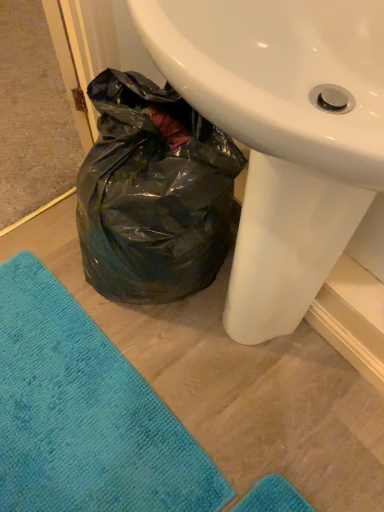
Question: From a real-world perspective, is teal soft towel at lower left physically below white glossy sink at center?

Choices:
 (A) no
 (B) yes

Answer: (B)

Question: Does teal soft towel at lower left have a smaller size compared to white glossy sink at center?

Choices:
 (A) yes
 (B) no

Answer: (A)

Question: From the image's perspective, does teal soft towel at lower left appear lower than white glossy sink at center?

Choices:
 (A) yes
 (B) no

Answer: (A)

Question: Is teal soft towel at lower left bigger than white glossy sink at center?

Choices:
 (A) yes
 (B) no

Answer: (B)

Question: Considering the relative sizes of teal soft towel at lower left and white glossy sink at center in the image provided, is teal soft towel at lower left shorter than white glossy sink at center?

Choices:
 (A) no
 (B) yes

Answer: (B)

Question: Can you see teal soft towel at lower left touching white glossy sink at center?

Choices:
 (A) no
 (B) yes

Answer: (A)

Question: Considering the relative sizes of white glossy sink at center and teal soft towel at lower left in the image provided, is white glossy sink at center smaller than teal soft towel at lower left?

Choices:
 (A) no
 (B) yes

Answer: (A)

Question: Does white glossy sink at center lie in front of teal soft towel at lower left?

Choices:
 (A) yes
 (B) no

Answer: (A)

Question: Can you confirm if white glossy sink at center is positioned to the right of teal soft towel at lower left?

Choices:
 (A) no
 (B) yes

Answer: (B)

Question: Does white glossy sink at center appear on the left side of teal soft towel at lower left?

Choices:
 (A) no
 (B) yes

Answer: (A)

Question: From a real-world perspective, does white glossy sink at center sit lower than teal soft towel at lower left?

Choices:
 (A) yes
 (B) no

Answer: (B)

Question: Does white glossy sink at center have a greater height compared to teal soft towel at lower left?

Choices:
 (A) no
 (B) yes

Answer: (B)

Question: From their relative heights in the image, would you say white glossy sink at center is taller or shorter than teal soft towel at lower left?

Choices:
 (A) tall
 (B) short

Answer: (A)